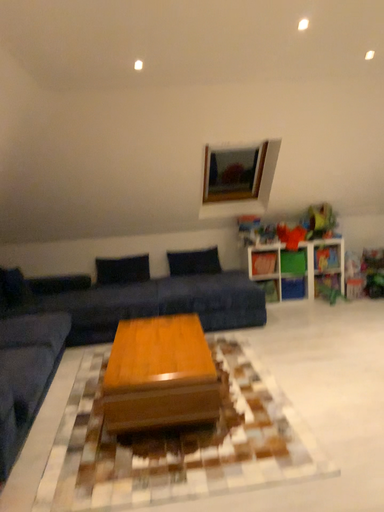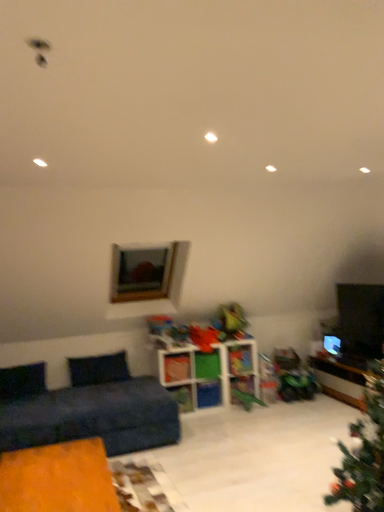
Question: How did the camera likely rotate when shooting the video?

Choices:
 (A) rotated downward
 (B) rotated upward

Answer: (B)